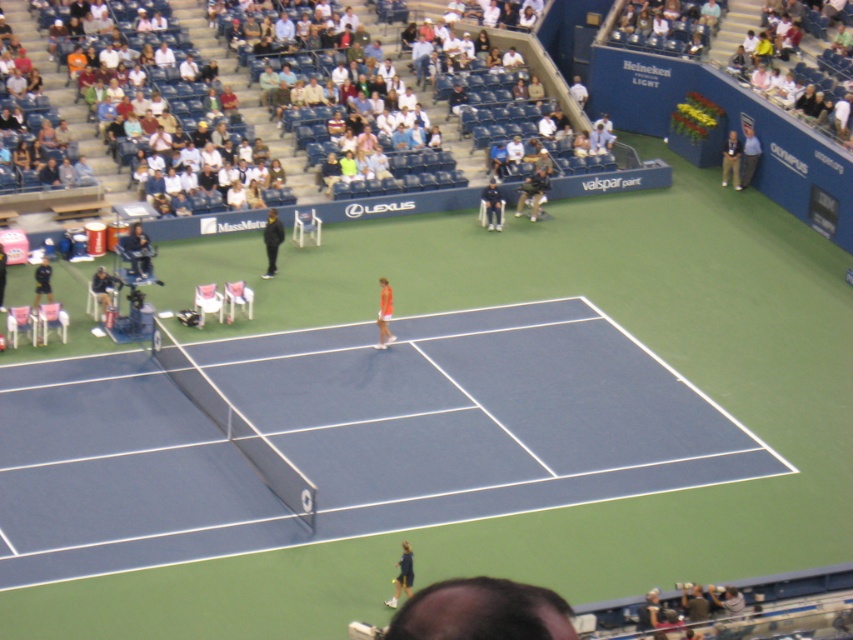
Question: Is khaki pants at upper right above dark blue uniform at center?

Choices:
 (A) yes
 (B) no

Answer: (A)

Question: Can you confirm if khaki pants at upper right is wider than black matte jacket at upper center?

Choices:
 (A) yes
 (B) no

Answer: (B)

Question: Based on their relative distances, which object is farther from the dark blue uniform at center?

Choices:
 (A) dark blue uniform at lower left
 (B) khaki pants at upper right
 (C) white fabric tennis outfit at center

Answer: (A)

Question: Which point is farther to the camera?

Choices:
 (A) (384, 300)
 (B) (274, 257)

Answer: (B)

Question: Is dark blue uniform at center smaller than dark blue uniform at lower left?

Choices:
 (A) no
 (B) yes

Answer: (B)

Question: Which point is farther from the camera taking this photo?

Choices:
 (A) (492, 198)
 (B) (726, 160)
 (C) (399, 582)

Answer: (B)